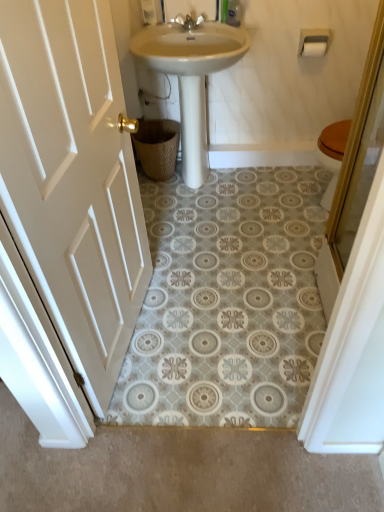
Measure the distance between white matte toilet paper at upper right and camera.

white matte toilet paper at upper right and camera are 2.31 meters apart.

Image resolution: width=384 pixels, height=512 pixels. What do you see at coordinates (191, 77) in the screenshot? I see `white glossy sink at center` at bounding box center [191, 77].

The width and height of the screenshot is (384, 512). In order to click on clear plastic bottle at upper center in this screenshot , I will do `click(234, 13)`.

The height and width of the screenshot is (512, 384). In order to click on woven brown basket at lower center in this screenshot , I will do `click(157, 147)`.

From the image's perspective, who appears lower, white matte toilet paper at upper right or white wood door at left?

white wood door at left is shown below in the image.

Is white matte toilet paper at upper right aimed at white wood door at left?

No, white matte toilet paper at upper right is not oriented towards white wood door at left.

Which is behind, white matte toilet paper at upper right or white wood door at left?

white matte toilet paper at upper right.

Between white matte toilet paper at upper right and white wood door at left, which one has smaller size?

With smaller size is white matte toilet paper at upper right.

Locate an element on the screen. The width and height of the screenshot is (384, 512). toilet paper beneath the silver metallic faucet at upper center (from a real-world perspective) is located at coordinates (314, 47).

Is silver metallic faucet at upper center not inside white matte toilet paper at upper right?

Yes, silver metallic faucet at upper center is not within white matte toilet paper at upper right.

Is silver metallic faucet at upper center far from white matte toilet paper at upper right?

No, there isn't a large distance between silver metallic faucet at upper center and white matte toilet paper at upper right.

Is silver metallic faucet at upper center further to camera compared to white matte toilet paper at upper right?

No, it is not.

From a real-world perspective, does white plastic toilet paper holder at upper right sit lower than white wood door at left?

No.

Are white plastic toilet paper holder at upper right and white wood door at left far apart?

Absolutely, white plastic toilet paper holder at upper right is distant from white wood door at left.

Which object is thinner, white plastic toilet paper holder at upper right or white wood door at left?

white plastic toilet paper holder at upper right.

Is white plastic toilet paper holder at upper right in front of white wood door at left?

No, white plastic toilet paper holder at upper right is further to the viewer.

Considering the points (75, 320) and (163, 154), which point is behind, point (75, 320) or point (163, 154)?

Point (163, 154)

From a real-world perspective, is white wood door at left over woven brown basket at lower center?

Yes.

Is white wood door at left oriented away from woven brown basket at lower center?

That's not correct — white wood door at left is not looking away from woven brown basket at lower center.

Based on the photo, between white wood door at left and woven brown basket at lower center, which one has larger size?

white wood door at left is bigger.

You are a GUI agent. You are given a task and a screenshot of the screen. Output one action in this format:
    pyautogui.click(x=<x>, y=<y>)
    Task: Click on the toilet paper below the silver metallic faucet at upper center (from the image's perspective)
    
    Given the screenshot: What is the action you would take?
    pyautogui.click(x=314, y=47)

Is white matte toilet paper at upper right spatially inside silver metallic faucet at upper center, or outside of it?

white matte toilet paper at upper right is not enclosed by silver metallic faucet at upper center.

Is white matte toilet paper at upper right directly adjacent to silver metallic faucet at upper center?

No, white matte toilet paper at upper right is not beside silver metallic faucet at upper center.

In terms of width, does white matte toilet paper at upper right look wider or thinner when compared to silver metallic faucet at upper center?

white matte toilet paper at upper right is thinner than silver metallic faucet at upper center.

Considering the points (121, 311) and (323, 32), which point is in front, point (121, 311) or point (323, 32)?

The point (121, 311) is in front.

Which of these two, white wood door at left or white plastic toilet paper holder at upper right, is wider?

Wider between the two is white wood door at left.

Does white wood door at left have a greater height compared to white plastic toilet paper holder at upper right?

Indeed, white wood door at left has a greater height compared to white plastic toilet paper holder at upper right.

Can you see white glossy sink at center touching white wood door at left?

They are not placed beside each other.

From the image's perspective, between white glossy sink at center and white wood door at left, which one is located above?

white glossy sink at center is shown above in the image.

Considering the sizes of objects white glossy sink at center and white wood door at left in the image provided, who is wider, white glossy sink at center or white wood door at left?

white glossy sink at center is wider.

Is white glossy sink at center to the right of white wood door at left from the viewer's perspective?

Yes, white glossy sink at center is to the right of white wood door at left.

Find the location of `toilet paper lying behind the white wood door at left`. toilet paper lying behind the white wood door at left is located at coordinates (314, 47).

This screenshot has width=384, height=512. Find the location of `tap above the white matte toilet paper at upper right (from a real-world perspective)`. tap above the white matte toilet paper at upper right (from a real-world perspective) is located at coordinates (188, 21).

Based on the photo, when comparing their distances from white glossy sink at center, does white wood door at left or silver metallic faucet at upper center seem further?

white wood door at left is further to white glossy sink at center.

From the picture: Which object lies further to the anchor point white glossy sink at center, white plastic toilet paper holder at upper right or white matte toilet paper at upper right?

white matte toilet paper at upper right lies further to white glossy sink at center than the other object.

Consider the image. Looking at the image, which one is located further to white matte toilet paper at upper right, white wood door at left or white plastic toilet paper holder at upper right?

white wood door at left.

Based on their spatial positions, is woven brown basket at lower center or white glossy sink at center closer to silver metallic faucet at upper center?

Among the two, white glossy sink at center is located nearer to silver metallic faucet at upper center.

Looking at the image, which one is located further to white matte toilet paper at upper right, clear plastic bottle at upper center or woven brown basket at lower center?

Based on the image, woven brown basket at lower center appears to be further to white matte toilet paper at upper right.

Estimate the real-world distances between objects in this image. Which object is further from silver metallic faucet at upper center, white glossy sink at center or clear plastic bottle at upper center?

white glossy sink at center is positioned further to the anchor silver metallic faucet at upper center.

Considering their positions, is white wood door at left positioned further to clear plastic bottle at upper center than white plastic toilet paper holder at upper right?

white wood door at left is further to clear plastic bottle at upper center.

Considering their positions, is white glossy sink at center positioned closer to white matte toilet paper at upper right than woven brown basket at lower center?

Based on the image, white glossy sink at center appears to be nearer to white matte toilet paper at upper right.

What are the coordinates of `toiletry situated between silver metallic faucet at upper center and white plastic toilet paper holder at upper right from left to right` in the screenshot? It's located at (234, 13).

Locate an element on the screen. The width and height of the screenshot is (384, 512). tap positioned between white wood door at left and white plastic toilet paper holder at upper right from near to far is located at coordinates click(188, 21).

The width and height of the screenshot is (384, 512). In order to click on tap between white wood door at left and white matte toilet paper at upper right along the z-axis in this screenshot , I will do `click(188, 21)`.

At what (x,y) coordinates should I click in order to perform the action: click on towel bar between white wood door at left and white matte toilet paper at upper right in the front-back direction. Please return your answer as a coordinate pair (x, y). Looking at the image, I should click on (313, 42).